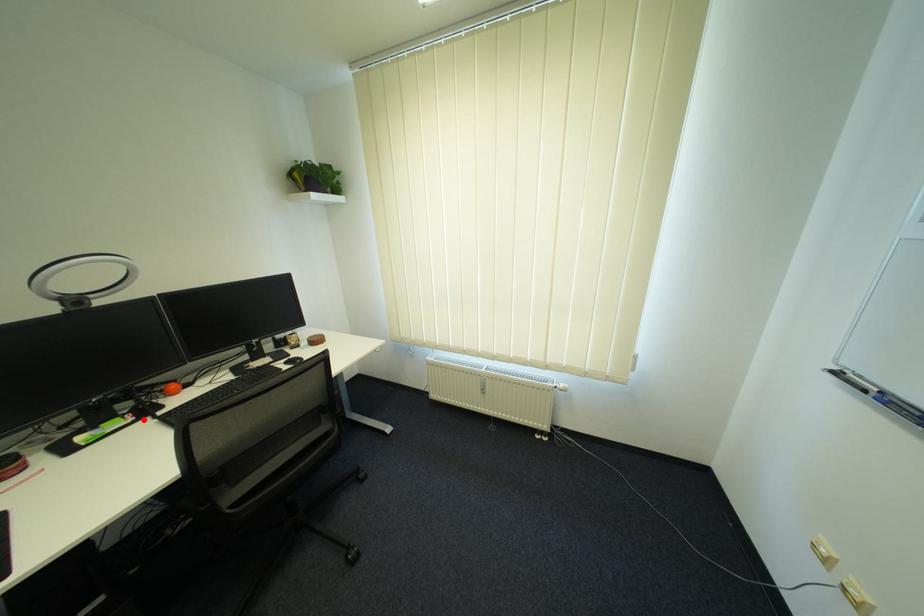
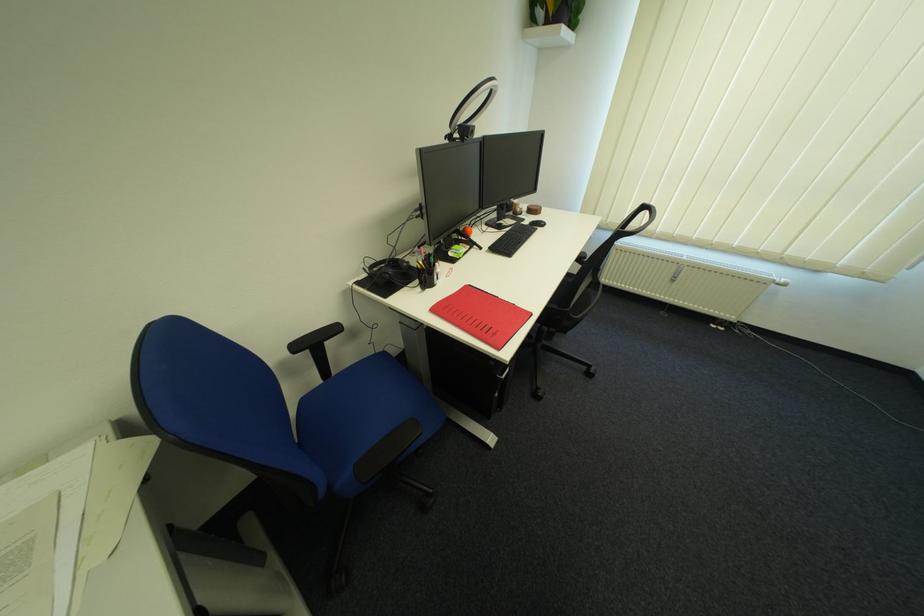
Locate, in the second image, the point that corresponds to the highlighted location in the first image.

(479, 248)